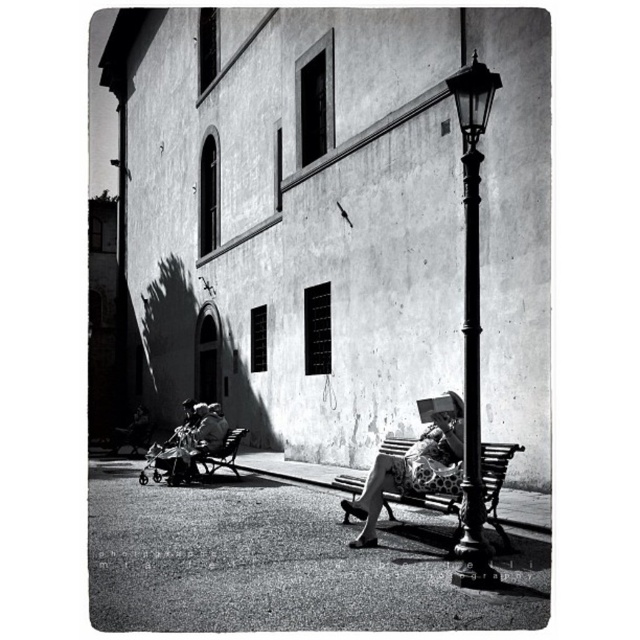
Question: Can you confirm if polished metal streetlamp at right is wider than polka dot dress at center?

Choices:
 (A) no
 (B) yes

Answer: (A)

Question: Which object is the closest to the polished metal streetlamp at right?

Choices:
 (A) polka dot dress at center
 (B) smooth fabric stroller at lower left

Answer: (A)

Question: Does polka dot dress at center have a larger size compared to smooth fabric stroller at lower left?

Choices:
 (A) yes
 (B) no

Answer: (A)

Question: From the image, what is the correct spatial relationship of polka dot dress at center in relation to smooth fabric stroller at lower left?

Choices:
 (A) above
 (B) below

Answer: (A)

Question: Which is nearer to the polka dot dress at center?

Choices:
 (A) polished metal streetlamp at right
 (B) smooth fabric stroller at lower left

Answer: (A)

Question: Which of the following is the closest to the observer?

Choices:
 (A) (189, 436)
 (B) (474, 468)

Answer: (B)